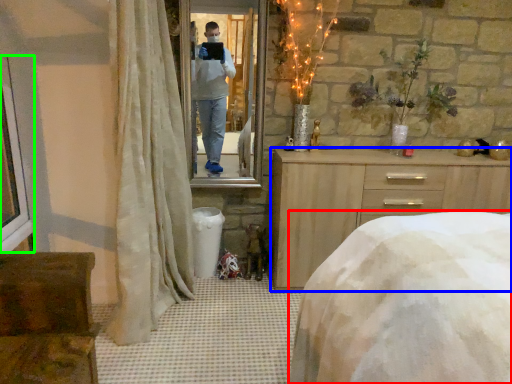
Question: Which object is the closest to the bed (highlighted by a red box)? Choose among these: chest of drawers (highlighted by a blue box) or window frame (highlighted by a green box).

Choices:
 (A) chest of drawers
 (B) window frame

Answer: (A)